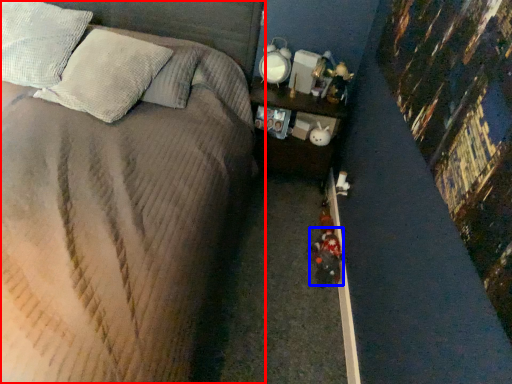
Question: Which object is further to the camera taking this photo, bed (highlighted by a red box) or toy (highlighted by a blue box)?

Choices:
 (A) bed
 (B) toy

Answer: (B)